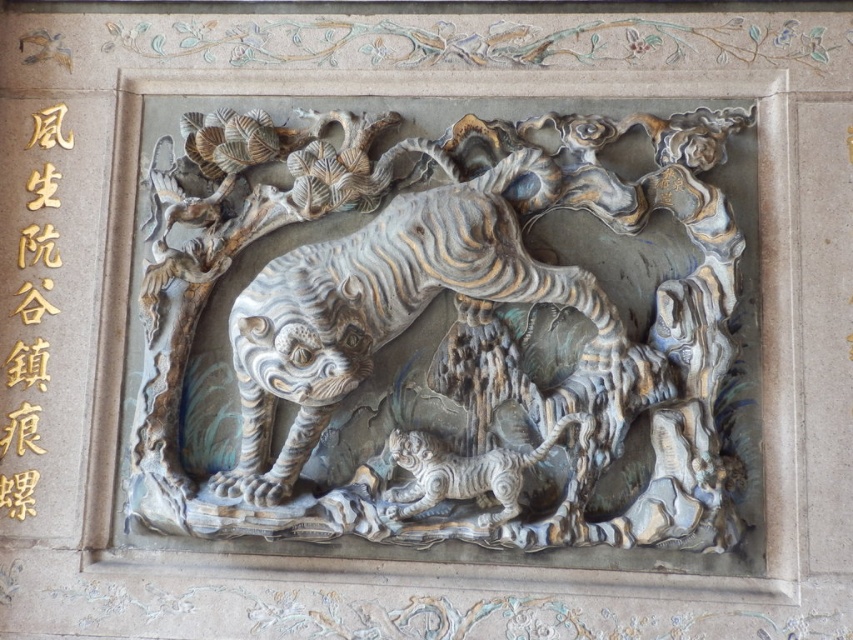
Question: Is goldmaterial/texturechinese characters at left closer to camera compared to white marble tiger at center?

Choices:
 (A) no
 (B) yes

Answer: (A)

Question: Which object is the farthest from the goldmaterial/texturechinese characters at left?

Choices:
 (A) white marble tiger at center
 (B) gray stone tiger at center

Answer: (A)

Question: Among these points, which one is farthest from the camera?

Choices:
 (A) (498, 486)
 (B) (21, 132)

Answer: (B)

Question: Which is farther from the gray stone tiger at center?

Choices:
 (A) white marble tiger at center
 (B) goldmaterial/texturechinese characters at left

Answer: (B)

Question: Does gray stone tiger at center come in front of white marble tiger at center?

Choices:
 (A) yes
 (B) no

Answer: (A)

Question: Is gray stone tiger at center below goldmaterial/texturechinese characters at left?

Choices:
 (A) yes
 (B) no

Answer: (B)